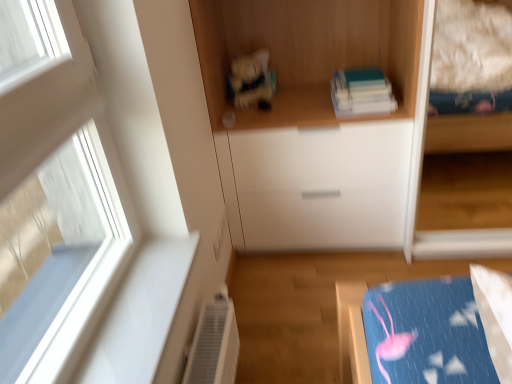
Question: From the image's perspective, would you say hardcover book at upper center is shown under wooden books at upper center?

Choices:
 (A) yes
 (B) no

Answer: (A)

Question: Is wooden books at upper center inside hardcover book at upper center?

Choices:
 (A) no
 (B) yes

Answer: (A)

Question: Can you confirm if hardcover book at upper center is positioned to the left of wooden books at upper center?

Choices:
 (A) no
 (B) yes

Answer: (A)

Question: From a real-world perspective, is hardcover book at upper center under wooden books at upper center?

Choices:
 (A) yes
 (B) no

Answer: (A)

Question: Does hardcover book at upper center have a smaller size compared to wooden books at upper center?

Choices:
 (A) yes
 (B) no

Answer: (A)

Question: Is hardcover book at upper center not close to wooden books at upper center?

Choices:
 (A) yes
 (B) no

Answer: (B)

Question: Is white glossy drawer at center beside wooden books at upper center?

Choices:
 (A) no
 (B) yes

Answer: (A)

Question: Can you confirm if white glossy drawer at center is shorter than wooden books at upper center?

Choices:
 (A) no
 (B) yes

Answer: (A)

Question: From a real-world perspective, is white glossy drawer at center under wooden books at upper center?

Choices:
 (A) no
 (B) yes

Answer: (B)

Question: Is white glossy drawer at center positioned before wooden books at upper center?

Choices:
 (A) yes
 (B) no

Answer: (B)

Question: Does white glossy drawer at center have a larger size compared to wooden books at upper center?

Choices:
 (A) yes
 (B) no

Answer: (A)

Question: Does white glossy drawer at center have a smaller size compared to wooden books at upper center?

Choices:
 (A) yes
 (B) no

Answer: (B)

Question: Is wooden books at upper center facing away from matte plastic toy at center?

Choices:
 (A) yes
 (B) no

Answer: (A)